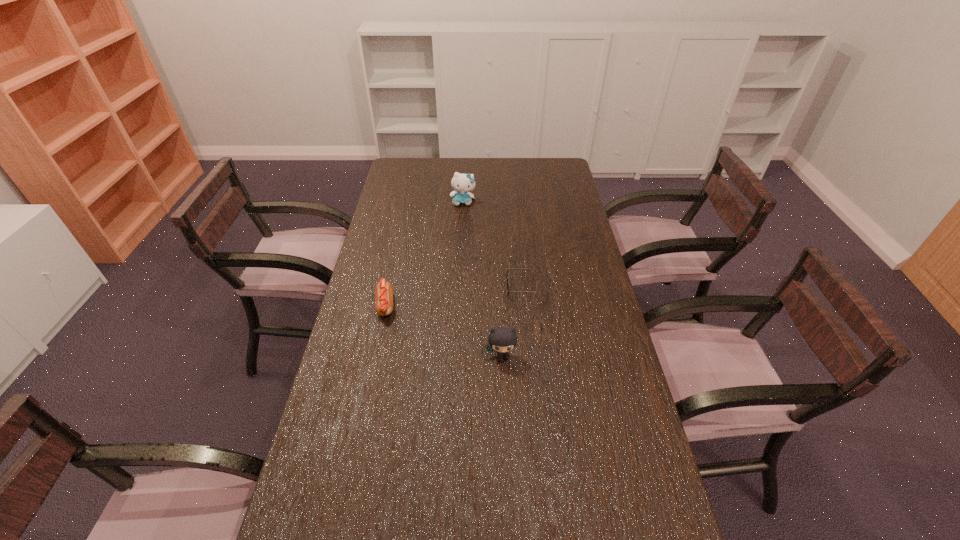
This screenshot has width=960, height=540. In order to click on the taller kitten in this screenshot , I will do `click(462, 183)`.

Identify the location of the tallest object. The width and height of the screenshot is (960, 540). (462, 183).

This screenshot has width=960, height=540. I want to click on the shorter kitten, so click(502, 339).

Identify the location of the nearer kitten. (502, 339).

Locate an element on the screen. The width and height of the screenshot is (960, 540). sausage is located at coordinates (383, 291).

This screenshot has width=960, height=540. What are the coordinates of `the second shortest object` in the screenshot? It's located at coord(383,291).

You are a GUI agent. You are given a task and a screenshot of the screen. Output one action in this format:
    pyautogui.click(x=<x>, y=<y>)
    Task: Click on the shortest object
    This screenshot has width=960, height=540.
    Given the screenshot: What is the action you would take?
    pyautogui.click(x=507, y=281)

Where is `free spot located 0.170m on the face of the tallest object`? free spot located 0.170m on the face of the tallest object is located at coordinates click(462, 232).

At what (x,y) coordinates should I click in order to perform the action: click on free region located on the front-facing side of the nearest object. Please return your answer as a coordinate pair (x, y). This screenshot has height=540, width=960. Looking at the image, I should click on (505, 429).

Identify the location of free space located on the right of the sausage. (441, 306).